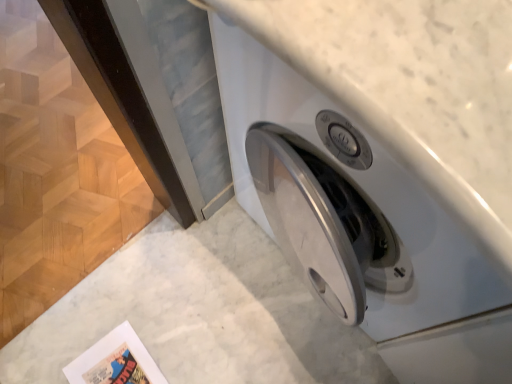
Question: Does matte paper comic book at lower left appear on the left side of white glossy washing machine at center?

Choices:
 (A) yes
 (B) no

Answer: (A)

Question: Does matte paper comic book at lower left have a larger size compared to white glossy washing machine at center?

Choices:
 (A) yes
 (B) no

Answer: (B)

Question: Can we say matte paper comic book at lower left lies outside white glossy washing machine at center?

Choices:
 (A) yes
 (B) no

Answer: (A)

Question: Considering the relative positions of matte paper comic book at lower left and white glossy washing machine at center in the image provided, is matte paper comic book at lower left to the right of white glossy washing machine at center from the viewer's perspective?

Choices:
 (A) yes
 (B) no

Answer: (B)

Question: From a real-world perspective, is matte paper comic book at lower left physically above white glossy washing machine at center?

Choices:
 (A) yes
 (B) no

Answer: (B)

Question: Considering the relative sizes of matte paper comic book at lower left and white glossy washing machine at center in the image provided, is matte paper comic book at lower left wider than white glossy washing machine at center?

Choices:
 (A) no
 (B) yes

Answer: (A)

Question: Is white glossy washing machine at center further to the viewer compared to matte paper comic book at lower left?

Choices:
 (A) no
 (B) yes

Answer: (A)

Question: Is white glossy washing machine at center far away from matte paper comic book at lower left?

Choices:
 (A) no
 (B) yes

Answer: (A)

Question: Considering the relative sizes of white glossy washing machine at center and matte paper comic book at lower left in the image provided, is white glossy washing machine at center wider than matte paper comic book at lower left?

Choices:
 (A) yes
 (B) no

Answer: (A)

Question: Does white glossy washing machine at center have a smaller size compared to matte paper comic book at lower left?

Choices:
 (A) no
 (B) yes

Answer: (A)

Question: From the image's perspective, is white glossy washing machine at center located beneath matte paper comic book at lower left?

Choices:
 (A) yes
 (B) no

Answer: (B)

Question: Is white glossy washing machine at center at the left side of matte paper comic book at lower left?

Choices:
 (A) yes
 (B) no

Answer: (B)

Question: From the image's perspective, is matte paper comic book at lower left above or below white glossy washing machine at center?

Choices:
 (A) above
 (B) below

Answer: (B)